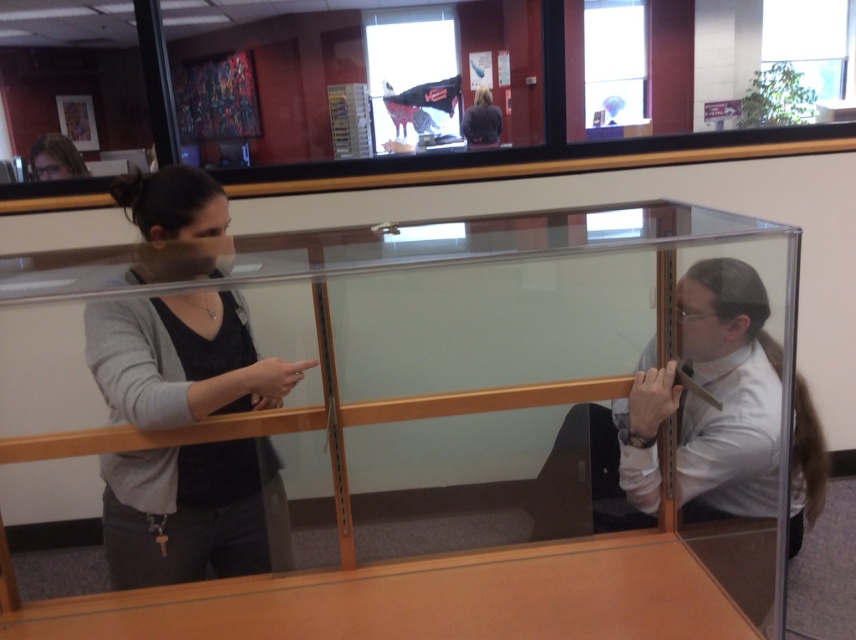
Question: Does transparent glass box at center appear under dark gray sweater at left?

Choices:
 (A) no
 (B) yes

Answer: (B)

Question: Which of the following is the farthest from the observer?

Choices:
 (A) matte black hair at upper left
 (B) white glossy shirt at right
 (C) dark brown hair at upper center

Answer: (C)

Question: Which of the following is the closest to the observer?

Choices:
 (A) (36, 166)
 (B) (181, 228)
 (C) (670, 401)
 (D) (58, 605)

Answer: (D)

Question: Is transparent glass box at center positioned behind dark gray sweater at left?

Choices:
 (A) no
 (B) yes

Answer: (A)

Question: Does matte black hair at upper left appear on the right side of dark brown hair at upper center?

Choices:
 (A) yes
 (B) no

Answer: (B)

Question: Which point is closer to the camera?

Choices:
 (A) (690, 300)
 (B) (40, 154)

Answer: (A)